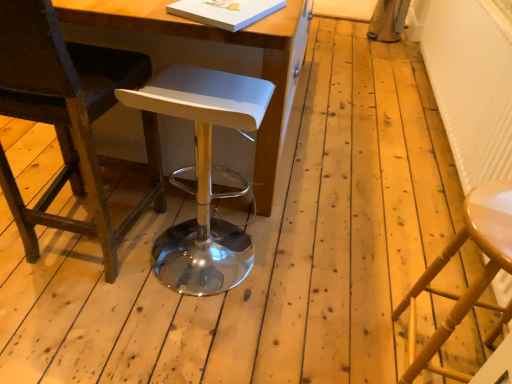
The width and height of the screenshot is (512, 384). I want to click on empty space that is in between wooden chair at right, positioned as the second stool in left-to-right order, and white textured radiator at right, so click(x=414, y=192).